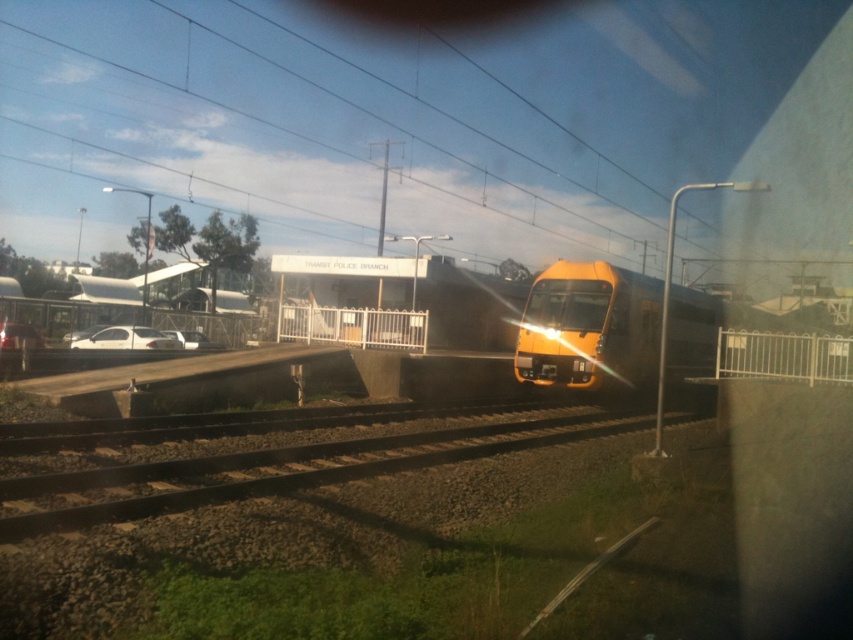
You are a passenger on a train and you want to know if you can safely walk from the metal tracks at center to the white matte car at left without getting hit by the approaching yellow and black train. The distance between them is 21.98 meters. If the train is moving at 30 km per hour, will you have enough time to cross before the train arrives?

The metal tracks at center and white matte car at left are 21.98 meters apart. The approaching yellow and black train is moving at 30 km per hour, which converts to approximately 8.33 meters per second. To calculate the time it would take for the train to reach the tracks, divide the distance by speed. However, the exact time needed to cross isnecessary to determine if it is safe. Without knowing the walking speed or the time required to cross 21.98 meters, it is impossible to confirm safety. Please provide

You are standing on the platform at the railway station and see the point marked at coordinates (268, 472). What object is located at that point?

The point at coordinates (268, 472) corresponds to the metal tracks at center.